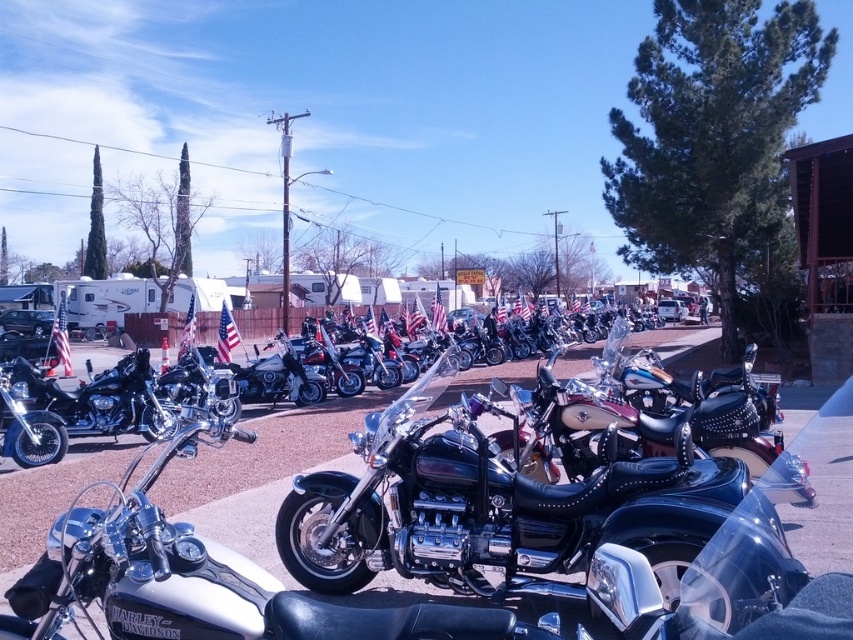
You are a photographer trying to capture both the polished chrome cruiser at center and the polished chrome motorcycle at center in a single frame. Based on their positions, which one should you position closer to the left side of your camera viewfinder?

The polished chrome cruiser at center is to the left of the polished chrome motorcycle at center, so you should position the polished chrome cruiser at center closer to the left side of your camera viewfinder to include both in the frame.

Based on the photo, you are a photographer at the event and want to capture both the polished chrome cruiser at center and the polished chrome motorcycle at center in a single frame. Which one will appear taller in the photo?

The polished chrome cruiser at center will appear taller in the photo because it has a greater height compared to the polished chrome motorcycle at center.